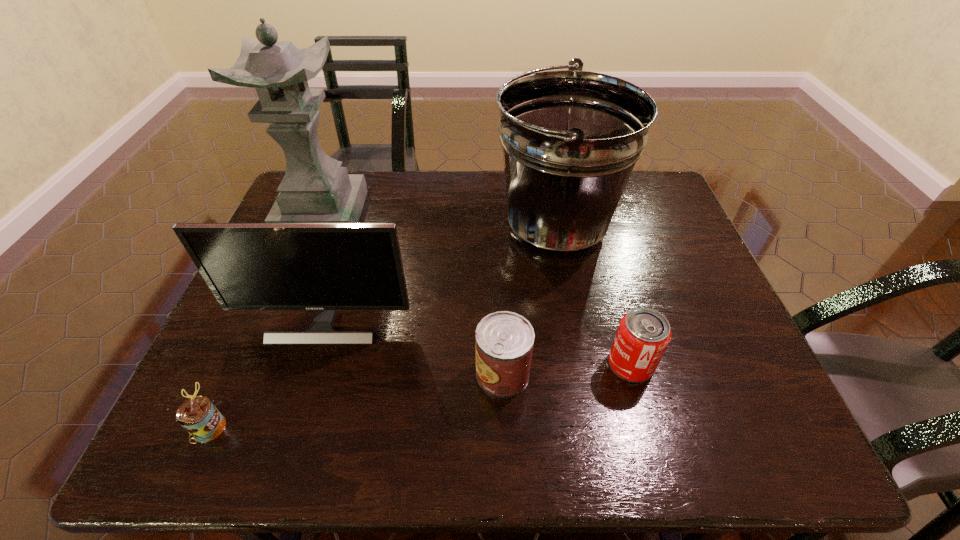
At what (x,y) coordinates should I click in order to perform the action: click on object that is at the far left corner. Please return your answer as a coordinate pair (x, y). Looking at the image, I should click on (315, 189).

This screenshot has width=960, height=540. What are the coordinates of `object that is at the near left corner` in the screenshot? It's located at (198, 416).

Find the location of a particular element. The width and height of the screenshot is (960, 540). vacant region at the far edge of the desktop is located at coordinates (446, 197).

At what (x,y) coordinates should I click in order to perform the action: click on vacant space at the near edge. Please return your answer as a coordinate pair (x, y). Looking at the image, I should click on (413, 434).

The image size is (960, 540). Identify the location of vacant space at the right edge. (679, 249).

The image size is (960, 540). In the image, there is a desktop. Find the location of `vacant space at the far right corner`. vacant space at the far right corner is located at coordinates (660, 215).

The width and height of the screenshot is (960, 540). What are the coordinates of `free area in between the second can from right to left and the tallest object` in the screenshot? It's located at (413, 294).

Where is `vacant area that lies between the shortest can and the rightmost can`? The height and width of the screenshot is (540, 960). vacant area that lies between the shortest can and the rightmost can is located at coordinates (420, 395).

Where is `free space that is in between the shortest can and the monitor`? The width and height of the screenshot is (960, 540). free space that is in between the shortest can and the monitor is located at coordinates (267, 374).

At what (x,y) coordinates should I click in order to perform the action: click on blank region between the fourth shortest object and the nearest can. Please return your answer as a coordinate pair (x, y). The height and width of the screenshot is (540, 960). Looking at the image, I should click on [x=267, y=374].